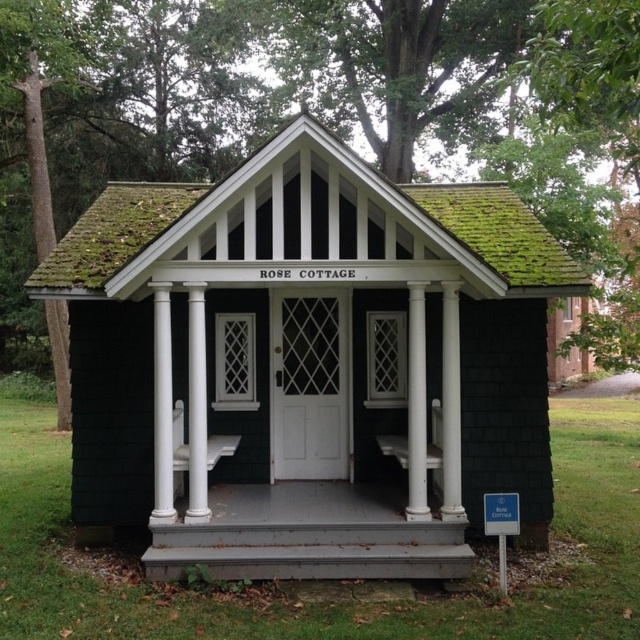
You are planning to paint the exterior of the black shingle cottage at center and the gray wood porch at center. Since you want to use the same amount of paint for both, which one would require more coats of paint to achieve the same coverage?

The black shingle cottage at center has a larger size compared to the gray wood porch at center, so it would require more coats of paint to cover the same area with the same amount of paint.

You are a delivery person trying to deliver a package to the ROSE COTTAGE. You have a cart that is 6 feet wide. Can you fit your cart between the black shingle cottage at center and the gray wood porch at center?

The black shingle cottage at center and gray wood porch at center are 6.47 feet apart from each other. Since the cart is 6 feet wide, it can fit through the space between them as 6 feet is less than 6.47 feet.